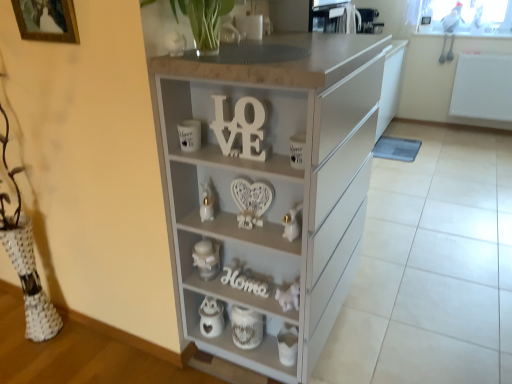
I want to click on white glossy mug at upper center, arranged as the 2th appliance when ordered from the bottom, so click(189, 135).

The height and width of the screenshot is (384, 512). What are the coordinates of `white glossy rabbit at center, marked as the first toy in a back-to-front arrangement` in the screenshot? It's located at (207, 202).

Identify the location of white glossy rabbit at lower center, the first toy from the right. The height and width of the screenshot is (384, 512). (292, 223).

At what (x,y) coordinates should I click in order to perform the action: click on wooden letters at center, the second alphabet when ordered from back to front. Please return your answer as a coordinate pair (x, y). Looking at the image, I should click on (241, 128).

At what (x,y) coordinates should I click in order to perform the action: click on wooden framed picture at upper left. Please return your answer as a coordinate pair (x, y). Looking at the image, I should click on (47, 20).

What do you see at coordinates (246, 327) in the screenshot? The height and width of the screenshot is (384, 512). I see `white textured ceramic jar at lower center` at bounding box center [246, 327].

Locate an element on the screen. This screenshot has width=512, height=384. white glossy mug at upper center, which is the first appliance from left to right is located at coordinates click(x=189, y=135).

Based on the photo, considering the relative sizes of white matte chest of drawers at center and white glossy mug at upper center, marked as the first appliance in a front-to-back arrangement, in the image provided, is white matte chest of drawers at center bigger than white glossy mug at upper center, marked as the first appliance in a front-to-back arrangement,?

Indeed, white matte chest of drawers at center has a larger size compared to white glossy mug at upper center, marked as the first appliance in a front-to-back arrangement.

In the image, there is a white glossy mug at upper center, arranged as the 2th appliance when ordered from the bottom. Where is `the chest of drawers below it (from a real-world perspective)`? The height and width of the screenshot is (384, 512). the chest of drawers below it (from a real-world perspective) is located at coordinates (273, 184).

Is white matte chest of drawers at center positioned before white glossy mug at upper center, which is the first appliance from left to right?

Yes, it is.

From a real-world perspective, is white glossy mug at upper center, the 3th appliance from the right, positioned over metallic silver toaster at upper center, which is the third appliance in front-to-back order, based on gravity?

Actually, white glossy mug at upper center, the 3th appliance from the right, is physically below metallic silver toaster at upper center, which is the third appliance in front-to-back order, in the real world.

Considering the relative sizes of white glossy mug at upper center, which ranks as the third appliance in back-to-front order, and metallic silver toaster at upper center, the first appliance viewed from the back, in the image provided, is white glossy mug at upper center, which ranks as the third appliance in back-to-front order, thinner than metallic silver toaster at upper center, the first appliance viewed from the back,?

Correct, the width of white glossy mug at upper center, which ranks as the third appliance in back-to-front order, is less than that of metallic silver toaster at upper center, the first appliance viewed from the back.

Between white glossy mug at upper center, which is the first appliance from left to right, and metallic silver toaster at upper center, which appears as the third appliance when viewed from the left, which one has more height?

metallic silver toaster at upper center, which appears as the third appliance when viewed from the left, is taller.

Which of these two, white glossy mug at upper center, which ranks as the third appliance in back-to-front order, or white glossy owl at lower center, the first appliance positioned from the bottom, is thinner?

white glossy owl at lower center, the first appliance positioned from the bottom, is thinner.

In the scene shown: Is white glossy mug at upper center, arranged as the 2th appliance when ordered from the bottom, oriented away from white glossy owl at lower center, arranged as the 3th appliance when viewed from the top?

That's not correct — white glossy mug at upper center, arranged as the 2th appliance when ordered from the bottom, is not looking away from white glossy owl at lower center, arranged as the 3th appliance when viewed from the top.

Is white glossy mug at upper center, marked as the first appliance in a front-to-back arrangement, at the left side of white glossy owl at lower center, which is the 2th appliance from right to left?

Yes, white glossy mug at upper center, marked as the first appliance in a front-to-back arrangement, is to the left of white glossy owl at lower center, which is the 2th appliance from right to left.

From a real-world perspective, who is located lower, white glossy mug at upper center, which is the first appliance from left to right, or white glossy owl at lower center, acting as the second appliance starting from the back?

white glossy owl at lower center, acting as the second appliance starting from the back, from a real-world perspective.

In the scene shown: Can you confirm if white glossy owl at lower center, arranged as the 3th appliance when viewed from the top, is thinner than wooden framed picture at upper left?

In fact, white glossy owl at lower center, arranged as the 3th appliance when viewed from the top, might be wider than wooden framed picture at upper left.

Between white glossy owl at lower center, the 2th appliance viewed from the left, and wooden framed picture at upper left, which one appears on the right side from the viewer's perspective?

white glossy owl at lower center, the 2th appliance viewed from the left.

From the picture: Who is more distant, white glossy owl at lower center, acting as the second appliance starting from the back, or wooden framed picture at upper left?

white glossy owl at lower center, acting as the second appliance starting from the back, is further away from the camera.

What's the angular difference between wooden letters at center, the second alphabet when ordered from back to front, and white textured ceramic jar at lower center's facing directions?

They differ by 9.82e-05 degrees in their facing directions.

This screenshot has width=512, height=384. Identify the location of tea set located on the right of wooden letters at center, which ranks as the 2th alphabet in bottom-to-top order. (246, 327).

Is wooden letters at center, the second alphabet when ordered from back to front, looking in the opposite direction of white textured ceramic jar at lower center?

No, wooden letters at center, the second alphabet when ordered from back to front,'s orientation is not away from white textured ceramic jar at lower center.

Between point (231, 132) and point (223, 305), which one is positioned behind?

Point (223, 305)

Is metallic silver toaster at upper center, which appears as the third appliance when viewed from the left, positioned with its back to white glossy mug at upper center, which ranks as the third appliance in back-to-front order?

No.

Is the depth of metallic silver toaster at upper center, which is the third appliance in front-to-back order, less than that of white glossy mug at upper center, which is the first appliance from left to right?

That is False.

Is white glossy mug at upper center, marked as the second appliance in a top-to-bottom arrangement, surrounded by metallic silver toaster at upper center, which ranks as the 1th appliance in right-to-left order?

No, white glossy mug at upper center, marked as the second appliance in a top-to-bottom arrangement, is located outside of metallic silver toaster at upper center, which ranks as the 1th appliance in right-to-left order.

Is metallic silver toaster at upper center, which ranks as the 1th appliance in top-to-bottom order, wider than white glossy mug at upper center, the 3th appliance from the right?

Indeed, metallic silver toaster at upper center, which ranks as the 1th appliance in top-to-bottom order, has a greater width compared to white glossy mug at upper center, the 3th appliance from the right.

From the image's perspective, which is above, white wood home at center, the 1th alphabet in the bottom-to-top sequence, or wooden letters at center, arranged as the 1th alphabet when viewed from the top?

wooden letters at center, arranged as the 1th alphabet when viewed from the top, from the image's perspective.

From a real-world perspective, is white wood home at center, which appears as the 2th alphabet when viewed from the top, physically located above or below wooden letters at center, arranged as the 1th alphabet when viewed from the top?

From a real-world perspective, white wood home at center, which appears as the 2th alphabet when viewed from the top, is physically below wooden letters at center, arranged as the 1th alphabet when viewed from the top.

Can you confirm if white wood home at center, marked as the second alphabet in a front-to-back arrangement, is taller than wooden letters at center, which ranks as the 2th alphabet in bottom-to-top order?

No.

You are a GUI agent. You are given a task and a screenshot of the screen. Output one action in this format:
    pyautogui.click(x=<x>, y=<y>)
    Task: Click on the 1st appliance behind when counting from the white matte chest of drawers at center
    
    Given the screenshot: What is the action you would take?
    pyautogui.click(x=189, y=135)

From a real-world perspective, starting from the metallic silver toaster at upper center, which appears as the third appliance when viewed from the left, which appliance is the 1st one below it? Please provide its 2D coordinates.

[(189, 135)]

From the image, which object appears to be nearer to white glossy mug at upper center, which is the first appliance from left to right, white glossy rabbit at center, marked as the first toy in a back-to-front arrangement, or white matte chest of drawers at center?

white glossy rabbit at center, marked as the first toy in a back-to-front arrangement, is closer to white glossy mug at upper center, which is the first appliance from left to right.

Estimate the real-world distances between objects in this image. Which object is further from white glossy mug at upper center, marked as the second appliance in a top-to-bottom arrangement, white wood home at center, which appears as the 2th alphabet when viewed from the top, or wooden framed picture at upper left?

Based on the image, white wood home at center, which appears as the 2th alphabet when viewed from the top, appears to be further to white glossy mug at upper center, marked as the second appliance in a top-to-bottom arrangement.

Estimate the real-world distances between objects in this image. Which object is closer to white glossy rabbit at lower center, the 2th toy viewed from the left, white matte chest of drawers at center or white glossy owl at lower center, acting as the second appliance starting from the back?

Based on the image, white matte chest of drawers at center appears to be nearer to white glossy rabbit at lower center, the 2th toy viewed from the left.

When comparing their distances from white glossy owl at lower center, the 2th appliance viewed from the left, does white glossy rabbit at center, marked as the first toy in a back-to-front arrangement, or white textured ceramic jar at lower center seem further?

Among the two, white glossy rabbit at center, marked as the first toy in a back-to-front arrangement, is located further to white glossy owl at lower center, the 2th appliance viewed from the left.

When comparing their distances from wooden letters at center, which ranks as the 2th alphabet in bottom-to-top order, does metallic silver toaster at upper center, which ranks as the 1th appliance in top-to-bottom order, or white wood home at center, the 1th alphabet in the bottom-to-top sequence, seem closer?

Based on the image, white wood home at center, the 1th alphabet in the bottom-to-top sequence, appears to be nearer to wooden letters at center, which ranks as the 2th alphabet in bottom-to-top order.

From the picture: When comparing their distances from metallic silver toaster at upper center, which appears as the third appliance when viewed from the left, does white textured ceramic jar at lower center or white matte chest of drawers at center seem closer?

Based on the image, white matte chest of drawers at center appears to be nearer to metallic silver toaster at upper center, which appears as the third appliance when viewed from the left.

From the image, which object appears to be farther from white glossy rabbit at lower center, the second toy in the back-to-front sequence, white wood home at center, the first alphabet from the back, or metallic silver toaster at upper center, which appears as the third appliance when viewed from the left?

metallic silver toaster at upper center, which appears as the third appliance when viewed from the left.

Looking at the image, which one is located closer to white wood home at center, which appears as the 2th alphabet when viewed from the top, white glossy rabbit at center, which appears as the first toy when viewed from the left, or white glossy owl at lower center, arranged as the 3th appliance when viewed from the top?

The object closer to white wood home at center, which appears as the 2th alphabet when viewed from the top, is white glossy owl at lower center, arranged as the 3th appliance when viewed from the top.

Where is `alphabet between white glossy rabbit at center, placed as the 2th toy when sorted from right to left, and white textured ceramic jar at lower center in the up-down direction`? The image size is (512, 384). alphabet between white glossy rabbit at center, placed as the 2th toy when sorted from right to left, and white textured ceramic jar at lower center in the up-down direction is located at coordinates (244, 282).

Identify the location of alphabet between white glossy rabbit at lower center, the first toy from the right, and white glossy owl at lower center, which is the 2th appliance from right to left, from top to bottom. (244, 282).

Identify the location of alphabet that lies between white glossy mug at upper center, arranged as the 2th appliance when ordered from the bottom, and white textured ceramic jar at lower center from top to bottom. The image size is (512, 384). (244, 282).

You are a GUI agent. You are given a task and a screenshot of the screen. Output one action in this format:
    pyautogui.click(x=<x>, y=<y>)
    Task: Click on the chest of drawers between wooden letters at center, arranged as the 1th alphabet when viewed from the top, and white glossy rabbit at lower center, the 2th toy viewed from the left, vertically
    The width and height of the screenshot is (512, 384).
    Given the screenshot: What is the action you would take?
    pyautogui.click(x=273, y=184)